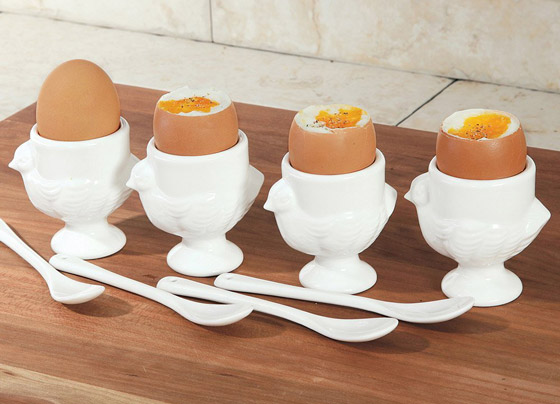
Locate an element on the screen. The image size is (560, 404). counter is located at coordinates (312, 81).